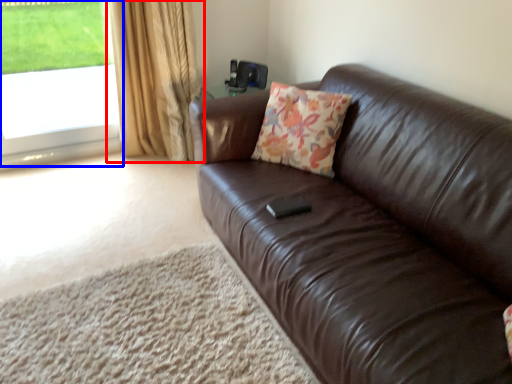
Question: Which point is closer to the camera, curtain (highlighted by a red box) or window (highlighted by a blue box)?

Choices:
 (A) curtain
 (B) window

Answer: (A)